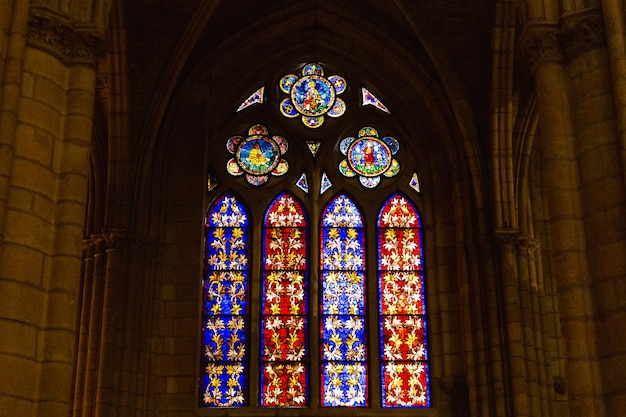
This screenshot has height=417, width=626. Find the location of `blue long windows`. blue long windows is located at coordinates (359, 278), (220, 289).